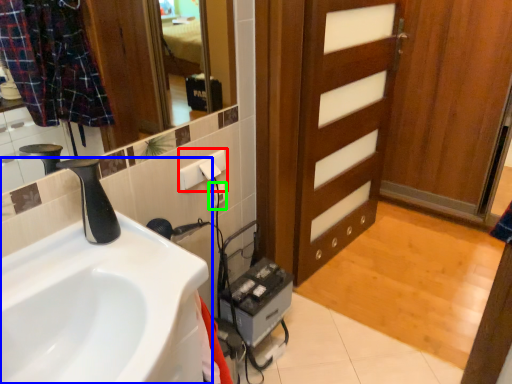
Question: Based on their relative distances, which object is nearer to electric outlet (highlighted by a red box)? Choose from sink (highlighted by a blue box) and electric outlet (highlighted by a green box).

Choices:
 (A) sink
 (B) electric outlet

Answer: (B)